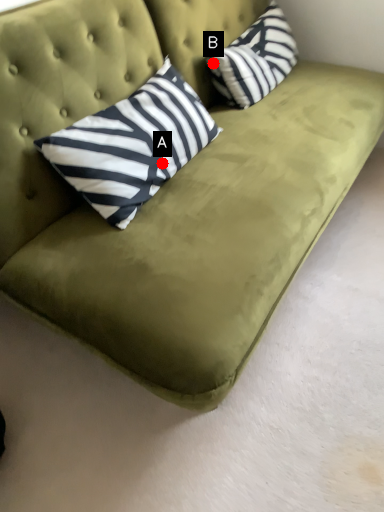
Question: Two points are circled on the image, labeled by A and B beside each circle. Which point is further to the camera?

Choices:
 (A) A is further
 (B) B is further

Answer: (B)